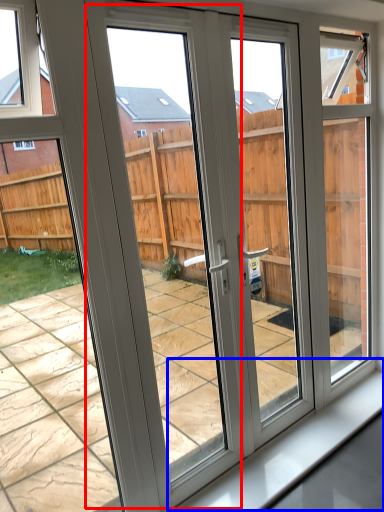
Question: Among these objects, which one is nearest to the camera, screen door (highlighted by a red box) or window sill (highlighted by a blue box)?

Choices:
 (A) screen door
 (B) window sill

Answer: (A)